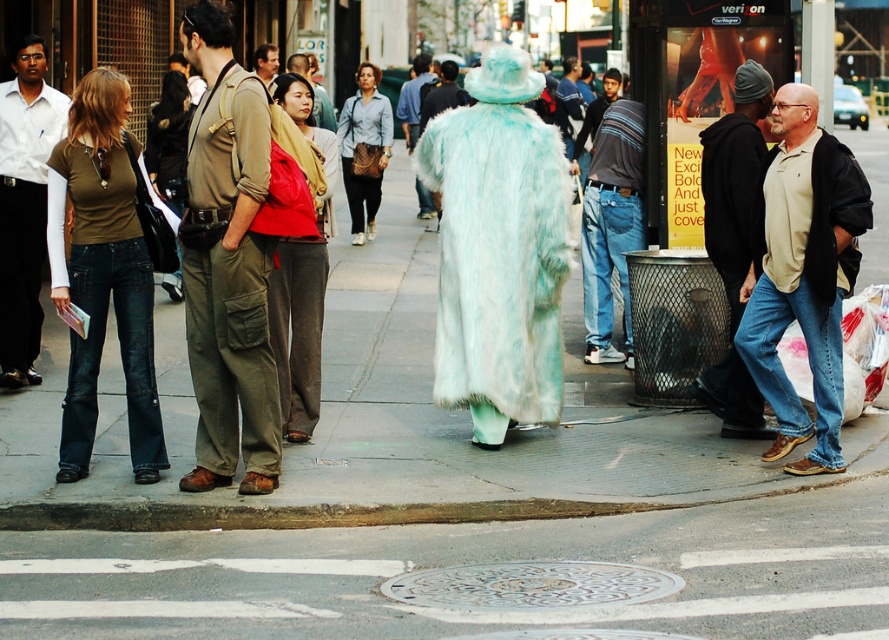
Question: Which point is closer to the camera?

Choices:
 (A) (493, 198)
 (B) (181, 193)
 (C) (0, 273)

Answer: (A)

Question: Does black hoodie at center appear under matte brown leather jacket at left?

Choices:
 (A) yes
 (B) no

Answer: (A)

Question: Which point is farther to the camera?

Choices:
 (A) gray concrete curb at lower center
 (B) light blue fur coat at center
 (C) fuzzy teal coat at center
 (D) khaki cargo pants at center

Answer: (C)

Question: Is matte green shirt at left bigger than red leather jacket at center?

Choices:
 (A) no
 (B) yes

Answer: (A)

Question: Among these objects, which one is farthest from the camera?

Choices:
 (A) fuzzy light blue coat at center
 (B) matte blue shirt at center

Answer: (A)

Question: Is beige cotton shirt at right wider than matte khaki pants at center?

Choices:
 (A) yes
 (B) no

Answer: (B)